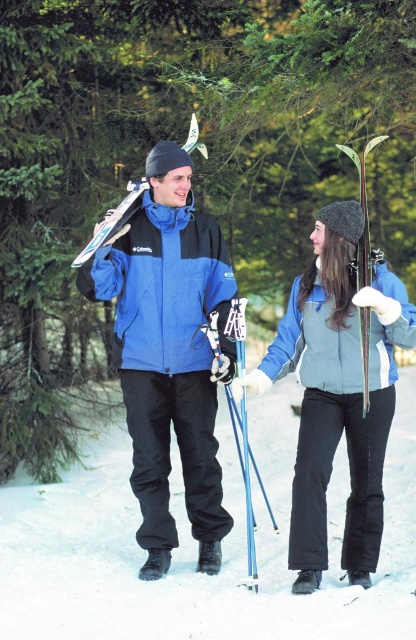
Question: Is metallic blue ski pole at center smaller than matte black ski at upper left?

Choices:
 (A) yes
 (B) no

Answer: (B)

Question: Is metallic blue ski pole at center closer to camera compared to matte black ski at upper left?

Choices:
 (A) yes
 (B) no

Answer: (A)

Question: Which object is closer to the camera taking this photo?

Choices:
 (A) matte black ski at upper left
 (B) light blue fleece vest at center
 (C) blue matte ski jacket at center
 (D) blue fabric jacket at center

Answer: (B)

Question: Among these points, which one is farthest from the camera?

Choices:
 (A) (71, 262)
 (B) (239, 320)
 (C) (215, 403)

Answer: (A)

Question: Can you confirm if blue matte ski jacket at center is positioned to the right of wooden skis at center?

Choices:
 (A) no
 (B) yes

Answer: (A)

Question: Which is farther from the blue fabric jacket at center?

Choices:
 (A) blue matte ski jacket at center
 (B) light blue fleece vest at center
 (C) wooden skis at center
 (D) metallic blue ski pole at center

Answer: (C)